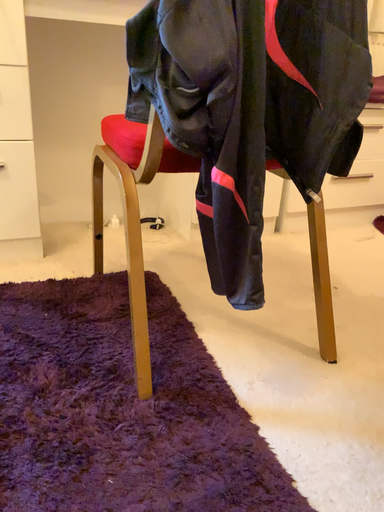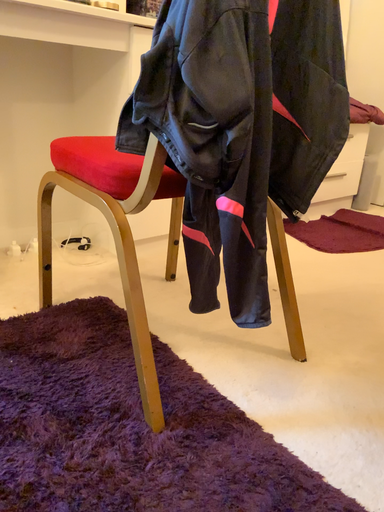
Question: Which way did the camera rotate in the video?

Choices:
 (A) rotated left
 (B) rotated right

Answer: (B)